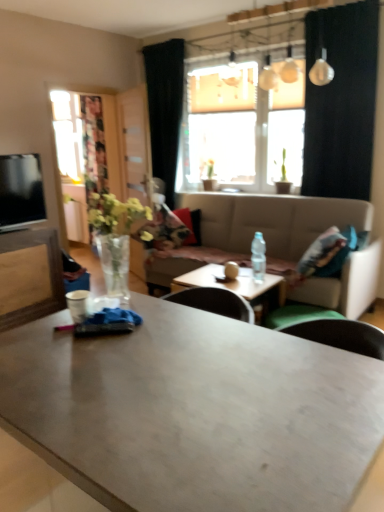
Question: Is translucent glass window at center outside transparent glass door at left?

Choices:
 (A) yes
 (B) no

Answer: (A)

Question: Is there a large distance between translucent glass window at center and transparent glass door at left?

Choices:
 (A) yes
 (B) no

Answer: (A)

Question: Does translucent glass window at center have a greater height compared to transparent glass door at left?

Choices:
 (A) no
 (B) yes

Answer: (A)

Question: Considering the relative sizes of translucent glass window at center and transparent glass door at left in the image provided, is translucent glass window at center thinner than transparent glass door at left?

Choices:
 (A) no
 (B) yes

Answer: (A)

Question: Is translucent glass window at center positioned in front of transparent glass door at left?

Choices:
 (A) no
 (B) yes

Answer: (B)

Question: In the image, is clear glass vase at left positioned in front of or behind wooden entertainment center at left?

Choices:
 (A) behind
 (B) front

Answer: (B)

Question: Is clear glass vase at left wider or thinner than wooden entertainment center at left?

Choices:
 (A) thin
 (B) wide

Answer: (A)

Question: Considering the positions of clear glass vase at left and wooden entertainment center at left in the image, is clear glass vase at left bigger or smaller than wooden entertainment center at left?

Choices:
 (A) small
 (B) big

Answer: (A)

Question: Is point (122, 228) closer or farther from the camera than point (56, 286)?

Choices:
 (A) farther
 (B) closer

Answer: (B)

Question: From a real-world perspective, is matte gray coffee table at center, which is counted as the first coffee table, starting from the front, physically located above or below wooden table at center, the second coffee table from the front?

Choices:
 (A) above
 (B) below

Answer: (A)

Question: In the image, is matte gray coffee table at center, the 2th coffee table from the back, on the left side or the right side of wooden table at center, the second coffee table from the front?

Choices:
 (A) right
 (B) left

Answer: (B)

Question: Looking at their shapes, would you say matte gray coffee table at center, which is counted as the first coffee table, starting from the front, is wider or thinner than wooden table at center, arranged as the first coffee table when viewed from the back?

Choices:
 (A) thin
 (B) wide

Answer: (B)

Question: In the image, is matte gray coffee table at center, which is counted as the first coffee table, starting from the front, positioned in front of or behind wooden table at center, arranged as the first coffee table when viewed from the back?

Choices:
 (A) front
 (B) behind

Answer: (A)

Question: Visually, is wooden entertainment center at left positioned to the left or to the right of wooden table at center, the second coffee table from the front?

Choices:
 (A) right
 (B) left

Answer: (B)

Question: Is wooden entertainment center at left spatially inside wooden table at center, arranged as the first coffee table when viewed from the back, or outside of it?

Choices:
 (A) outside
 (B) inside

Answer: (A)